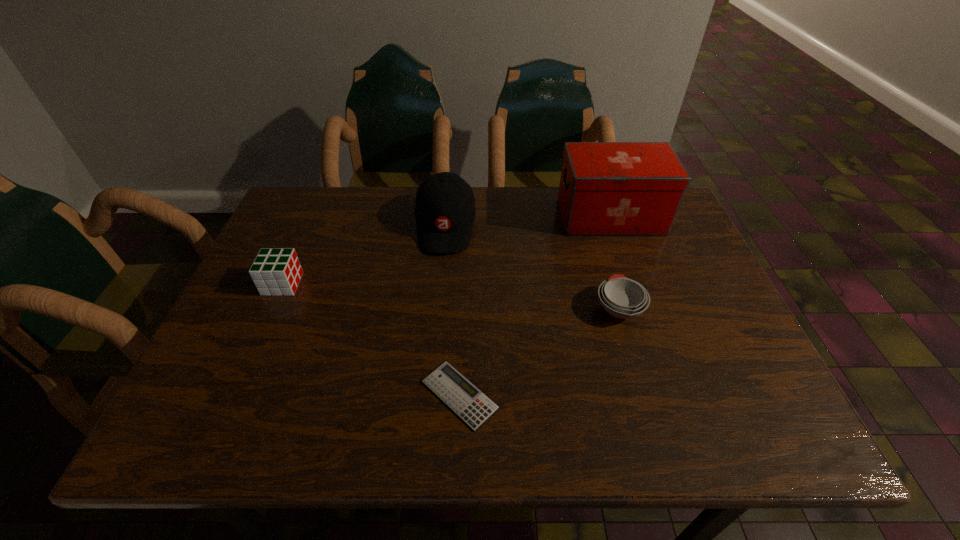
Where is `the tallest object`? the tallest object is located at coordinates (606, 188).

Identify the location of baseball cap. The width and height of the screenshot is (960, 540). (445, 209).

You are a GUI agent. You are given a task and a screenshot of the screen. Output one action in this format:
    pyautogui.click(x=<x>, y=<y>)
    Task: Click on the leftmost object
    The width and height of the screenshot is (960, 540).
    Given the screenshot: What is the action you would take?
    pyautogui.click(x=277, y=271)

The height and width of the screenshot is (540, 960). Find the location of `cube`. cube is located at coordinates (277, 271).

This screenshot has width=960, height=540. Find the location of `the fourth tallest object`. the fourth tallest object is located at coordinates (623, 298).

Where is `the shortest object`? the shortest object is located at coordinates (469, 403).

Locate an element on the screen. This screenshot has height=540, width=960. calculator is located at coordinates (469, 403).

The height and width of the screenshot is (540, 960). In order to click on free space located on the handle side of the first-aid kit in this screenshot , I will do 448,217.

Identify the location of blank space located on the handle side of the first-aid kit. (462, 217).

Locate an element on the screen. This screenshot has width=960, height=540. free location located on the handle side of the first-aid kit is located at coordinates (500, 217).